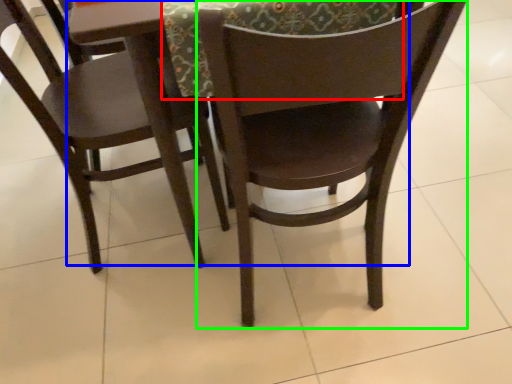
Question: Which object is the farthest from tablecloth (highlighted by a red box)? Choose among these: round table (highlighted by a blue box) or chair (highlighted by a green box).

Choices:
 (A) round table
 (B) chair

Answer: (B)